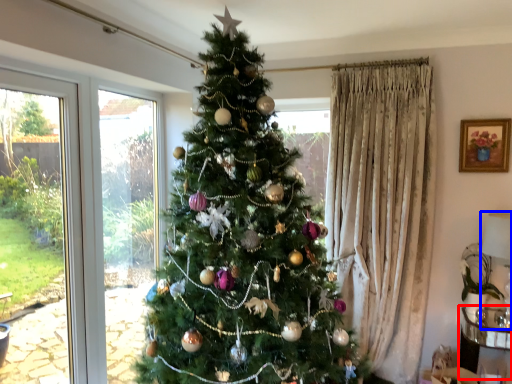
Question: Among these objects, which one is nearest to the camera, furniture (highlighted by a red box) or lamp (highlighted by a blue box)?

Choices:
 (A) furniture
 (B) lamp

Answer: (B)